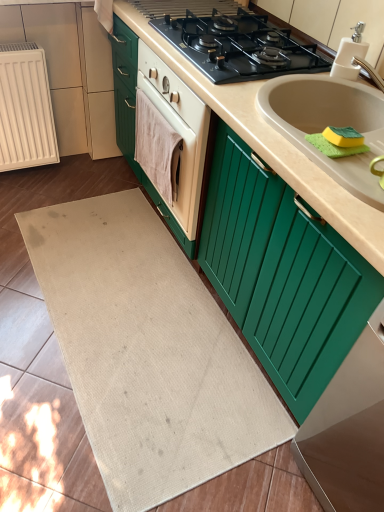
Locate an element on the screen. vacant area on top of beige matte countertop at center (from a real-world perspective) is located at coordinates (239, 53).